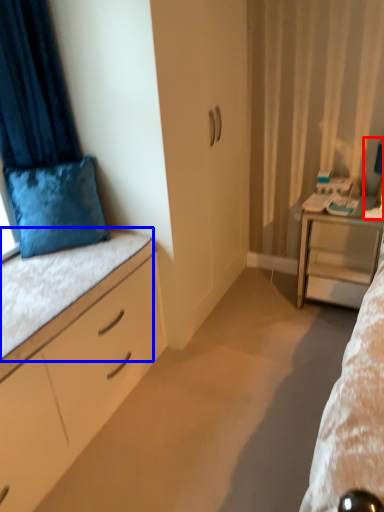
Question: Among these objects, which one is farthest to the camera, table lamp (highlighted by a red box) or ledge (highlighted by a blue box)?

Choices:
 (A) table lamp
 (B) ledge

Answer: (A)